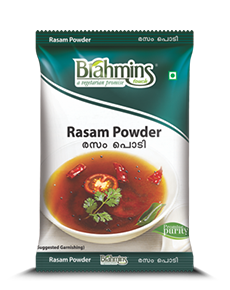
Where is `bowl`? bowl is located at coordinates (60, 156), (151, 152), (169, 193), (99, 237).